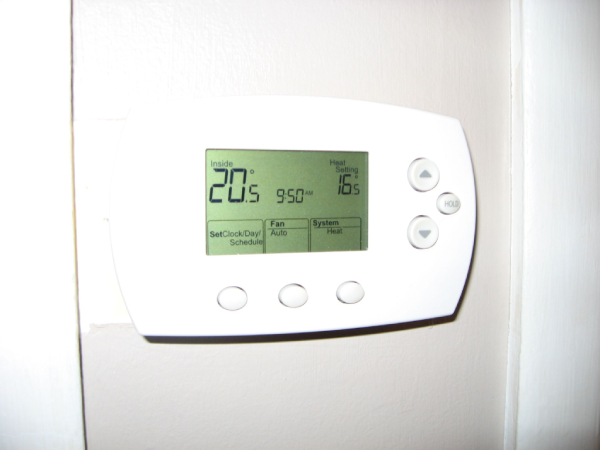
Where is `door jamb`? The width and height of the screenshot is (600, 450). door jamb is located at coordinates (547, 293), (59, 291).